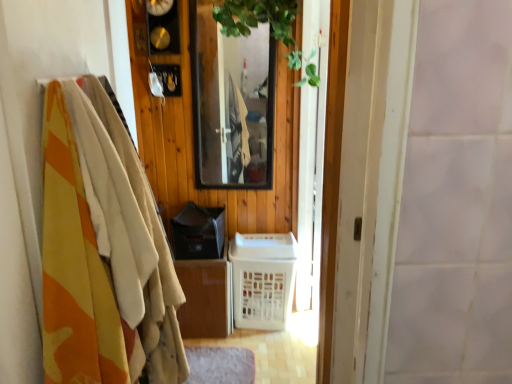
What do you see at coordinates (220, 365) in the screenshot?
I see `gray soft mat at lower center` at bounding box center [220, 365].

At what (x,y) coordinates should I click in order to perform the action: click on gray soft mat at lower center. Please return your answer as a coordinate pair (x, y). The height and width of the screenshot is (384, 512). Looking at the image, I should click on (220, 365).

Image resolution: width=512 pixels, height=384 pixels. I want to click on camouflage fabric blanket at left, so click(101, 257).

This screenshot has width=512, height=384. What do you see at coordinates (263, 279) in the screenshot? I see `white plastic basket at center` at bounding box center [263, 279].

This screenshot has height=384, width=512. Find the location of `green leafy plant at upper center`. green leafy plant at upper center is located at coordinates (271, 28).

Is green leafy plant at upper center completely or partially outside of gray soft mat at lower center?

Yes, green leafy plant at upper center is outside of gray soft mat at lower center.

Is green leafy plant at upper center looking in the opposite direction of gray soft mat at lower center?

No, green leafy plant at upper center is not facing the opposite direction of gray soft mat at lower center.

Can you confirm if green leafy plant at upper center is bigger than gray soft mat at lower center?

Correct, green leafy plant at upper center is larger in size than gray soft mat at lower center.

How many degrees apart are the facing directions of green leafy plant at upper center and gray soft mat at lower center?

176 degrees.

Consider the image. From a real-world perspective, between green leafy plant at upper center and clear glass mirror at center, who is vertically higher?

green leafy plant at upper center.

Looking at the image, does green leafy plant at upper center seem bigger or smaller compared to clear glass mirror at center?

In the image, green leafy plant at upper center appears to be larger than clear glass mirror at center.

Would you say green leafy plant at upper center is outside clear glass mirror at center?

green leafy plant at upper center lies outside clear glass mirror at center's area.

Can you see white plastic basket at center touching gray soft mat at lower center?

No, white plastic basket at center is not beside gray soft mat at lower center.

Between white plastic basket at center and gray soft mat at lower center, which one has smaller size?

With smaller size is gray soft mat at lower center.

Which of these two, white plastic basket at center or gray soft mat at lower center, is thinner?

gray soft mat at lower center.

Between gray soft mat at lower center and camouflage fabric blanket at left, which one has smaller width?

camouflage fabric blanket at left.

Is gray soft mat at lower center smaller than camouflage fabric blanket at left?

Yes.

Is gray soft mat at lower center oriented away from camouflage fabric blanket at left?

No, gray soft mat at lower center is not facing away from camouflage fabric blanket at left.

From the image's perspective, between gray soft mat at lower center and camouflage fabric blanket at left, which one is located above?

camouflage fabric blanket at left is shown above in the image.

Can you confirm if green leafy plant at upper center is bigger than camouflage fabric blanket at left?

Incorrect, green leafy plant at upper center is not larger than camouflage fabric blanket at left.

In terms of width, does green leafy plant at upper center look wider or thinner when compared to camouflage fabric blanket at left?

Considering their sizes, green leafy plant at upper center looks broader than camouflage fabric blanket at left.

In the scene shown: Is green leafy plant at upper center turned away from camouflage fabric blanket at left?

No, green leafy plant at upper center is not facing away from camouflage fabric blanket at left.

Is point (298, 68) farther from viewer compared to point (83, 317)?

That is True.

What's the angular difference between camouflage fabric blanket at left and green leafy plant at upper center's facing directions?

They differ by 84.2 degrees in their facing directions.

Which object is further away from the camera, camouflage fabric blanket at left or green leafy plant at upper center?

green leafy plant at upper center is further away from the camera.

Can you confirm if camouflage fabric blanket at left is thinner than green leafy plant at upper center?

Yes, camouflage fabric blanket at left is thinner than green leafy plant at upper center.

Is camouflage fabric blanket at left not near green leafy plant at upper center?

Yes, camouflage fabric blanket at left and green leafy plant at upper center are quite far apart.

Considering the sizes of objects white plastic basket at center and green leafy plant at upper center in the image provided, who is smaller, white plastic basket at center or green leafy plant at upper center?

white plastic basket at center is smaller.

How far apart are white plastic basket at center and green leafy plant at upper center?

white plastic basket at center is 1.25 meters away from green leafy plant at upper center.

Which object is thinner, white plastic basket at center or green leafy plant at upper center?

green leafy plant at upper center is thinner.

There is a white plastic basket at center. Where is `plant above it (from a real-world perspective)`? The width and height of the screenshot is (512, 384). plant above it (from a real-world perspective) is located at coordinates (271, 28).

The image size is (512, 384). Find the location of `plant above the gray soft mat at lower center (from the image's perspective)`. plant above the gray soft mat at lower center (from the image's perspective) is located at coordinates (271, 28).

Find the location of a particular element. mirror that appears on the left of green leafy plant at upper center is located at coordinates (231, 102).

Which object lies further to the anchor point camouflage fabric blanket at left, green leafy plant at upper center or white plastic basket at center?

green leafy plant at upper center lies further to camouflage fabric blanket at left than the other object.

From the image, which object appears to be nearer to clear glass mirror at center, camouflage fabric blanket at left or white plastic basket at center?

white plastic basket at center is positioned closer to the anchor clear glass mirror at center.

Based on their spatial positions, is camouflage fabric blanket at left or green leafy plant at upper center further from gray soft mat at lower center?

The object further to gray soft mat at lower center is green leafy plant at upper center.

Which object lies further to the anchor point green leafy plant at upper center, gray soft mat at lower center or white plastic basket at center?

gray soft mat at lower center.

Which object lies nearer to the anchor point white plastic basket at center, camouflage fabric blanket at left or gray soft mat at lower center?

gray soft mat at lower center is closer to white plastic basket at center.

Estimate the real-world distances between objects in this image. Which object is further from gray soft mat at lower center, camouflage fabric blanket at left or white plastic basket at center?

camouflage fabric blanket at left lies further to gray soft mat at lower center than the other object.

Based on their spatial positions, is gray soft mat at lower center or green leafy plant at upper center further from clear glass mirror at center?

gray soft mat at lower center is positioned further to the anchor clear glass mirror at center.

Considering their positions, is camouflage fabric blanket at left positioned further to green leafy plant at upper center than gray soft mat at lower center?

Based on the image, gray soft mat at lower center appears to be further to green leafy plant at upper center.

Locate an element on the screen. The width and height of the screenshot is (512, 384). plant between camouflage fabric blanket at left and clear glass mirror at center along the z-axis is located at coordinates (271, 28).

At what (x,y) coordinates should I click in order to perform the action: click on mirror between green leafy plant at upper center and white plastic basket at center in the up-down direction. Please return your answer as a coordinate pair (x, y). The height and width of the screenshot is (384, 512). Looking at the image, I should click on (231, 102).

Locate an element on the screen. The width and height of the screenshot is (512, 384). basket between clear glass mirror at center and gray soft mat at lower center from top to bottom is located at coordinates (263, 279).

Locate an element on the screen. The image size is (512, 384). plant positioned between camouflage fabric blanket at left and white plastic basket at center from near to far is located at coordinates (271, 28).